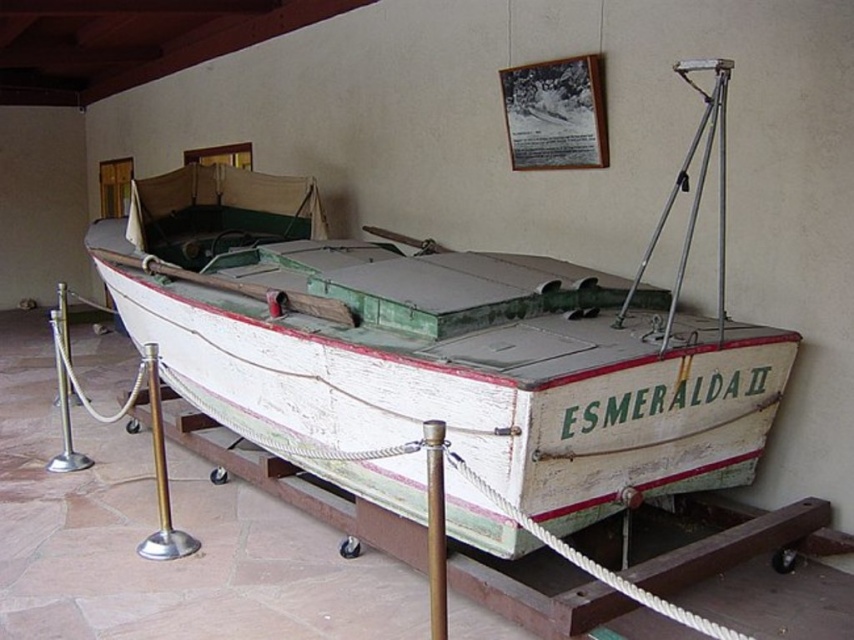
Question: Can you confirm if white wooden boat at center is positioned below brown wooden pole at center?

Choices:
 (A) no
 (B) yes

Answer: (A)

Question: In this image, where is white wooden boat at center located relative to brown wooden pole at center?

Choices:
 (A) right
 (B) left

Answer: (B)

Question: Which of these objects is positioned closest to the brown wooden pole at center?

Choices:
 (A) brushed metal pole at lower left
 (B) white wooden boat at center

Answer: (B)

Question: Which object appears closest to the camera in this image?

Choices:
 (A) metallic silver frame at upper center
 (B) brushed metal pole at lower left
 (C) white wooden boat at center
 (D) brown wooden pole at center

Answer: (D)

Question: Among these points, which one is farthest from the camera?

Choices:
 (A) (564, 93)
 (B) (570, 448)
 (C) (439, 436)

Answer: (A)

Question: Can you confirm if metallic silver frame at upper center is thinner than brushed metal pole at lower left?

Choices:
 (A) no
 (B) yes

Answer: (A)